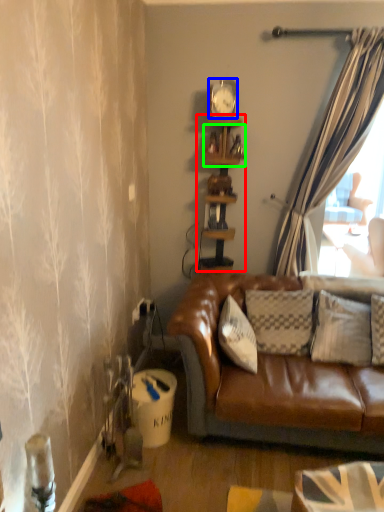
Question: Estimate the real-world distances between objects in this image. Which object is farther from shelf (highlighted by a red box), clock (highlighted by a blue box) or shelf (highlighted by a green box)?

Choices:
 (A) clock
 (B) shelf

Answer: (A)